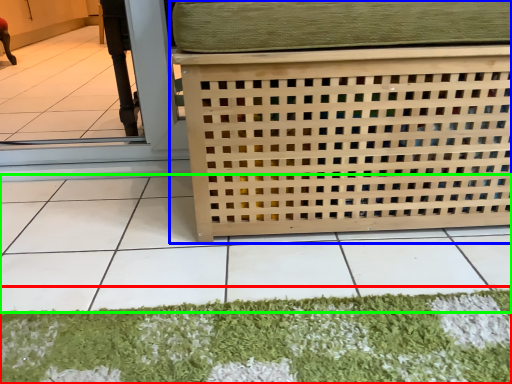
Question: Which is nearer to the mat (highlighted by a red box)? furniture (highlighted by a blue box) or tile (highlighted by a green box).

Choices:
 (A) furniture
 (B) tile

Answer: (B)